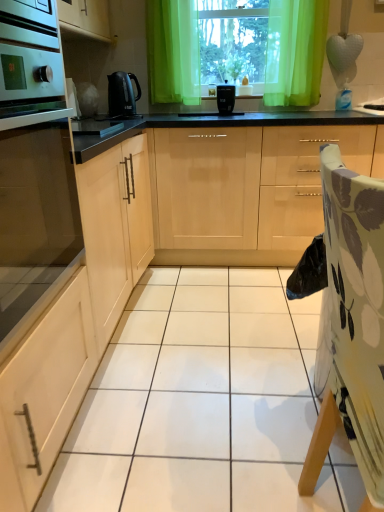
Question: Would you say green sheer curtain at upper center is to the left or to the right of floral fabric folding chair at right in the picture?

Choices:
 (A) right
 (B) left

Answer: (A)

Question: In the image, is green sheer curtain at upper center positioned in front of or behind floral fabric folding chair at right?

Choices:
 (A) behind
 (B) front

Answer: (A)

Question: Estimate the real-world distances between objects in this image. Which object is farther from the black plastic kettle at center, placed as the 1th kitchen appliance when sorted from left to right?

Choices:
 (A) matte wood cabinet at left, the 1th cabinetry from the left
 (B) satin wood cabinet at left, which is the 2th cabinetry from left to right
 (C) black plastic toaster at center, arranged as the 1th kitchen appliance when viewed from the right
 (D) green sheer curtains at upper center
 (E) floral fabric folding chair at right

Answer: (E)

Question: Based on their relative distances, which object is farther from the green sheer curtains at upper center?

Choices:
 (A) satin wood cabinet at left, which is the 2th cabinetry from left to right
 (B) matte wood cabinet at left, the 1th cabinetry from the left
 (C) black plastic kettle at center, positioned as the 2th kitchen appliance in right-to-left order
 (D) black plastic toaster at center, which is counted as the second kitchen appliance, starting from the left
 (E) light wood cabinet at center, which appears as the 3th cabinetry when viewed from the left

Answer: (A)